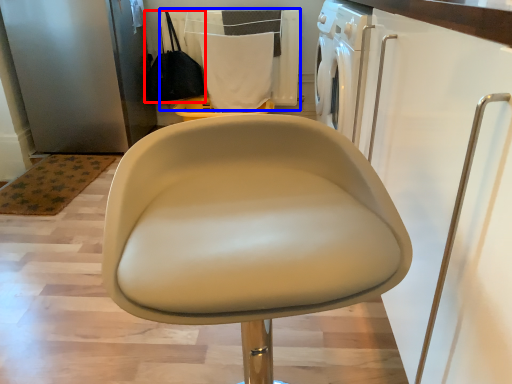
Question: Which object is closer to the camera taking this photo, handbag (highlighted by a red box) or laundry (highlighted by a blue box)?

Choices:
 (A) handbag
 (B) laundry

Answer: (B)